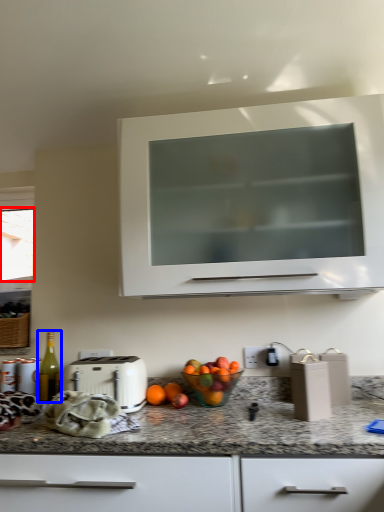
Question: Which object appears farthest to the camera in this image, window screen (highlighted by a red box) or bottle (highlighted by a blue box)?

Choices:
 (A) window screen
 (B) bottle

Answer: (A)